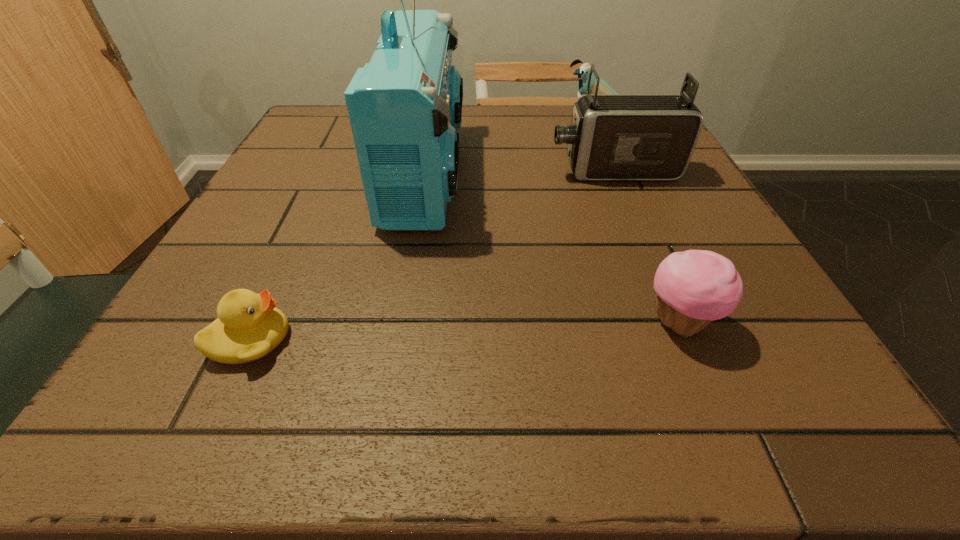
The width and height of the screenshot is (960, 540). In order to click on camcorder at the right edge in this screenshot , I will do `click(613, 137)`.

Image resolution: width=960 pixels, height=540 pixels. Identify the location of bird situated at the right edge. click(x=583, y=72).

You are a GUI agent. You are given a task and a screenshot of the screen. Output one action in this format:
    pyautogui.click(x=<x>, y=<y>)
    Task: Click on the cupcake present at the right edge
    The width and height of the screenshot is (960, 540).
    Given the screenshot: What is the action you would take?
    pyautogui.click(x=695, y=287)

At what (x,y) coordinates should I click in order to perform the action: click on object at the near left corner. Please return your answer as a coordinate pair (x, y). This screenshot has width=960, height=540. Looking at the image, I should click on (249, 326).

Where is `object at the far right corner`? This screenshot has height=540, width=960. object at the far right corner is located at coordinates (583, 72).

Identify the location of free space at the far edge. (515, 116).

Where is `vacant area at the near edge`? The image size is (960, 540). vacant area at the near edge is located at coordinates (535, 426).

At what (x,y) coordinates should I click in order to perform the action: click on free spot at the left edge of the desktop. Please return your answer as a coordinate pair (x, y). Looking at the image, I should click on (299, 293).

In the image, there is a desktop. In order to click on vacant space at the right edge in this screenshot , I will do `click(719, 244)`.

Locate an element on the screen. This screenshot has height=540, width=960. vacant space at the near right corner of the desktop is located at coordinates (804, 431).